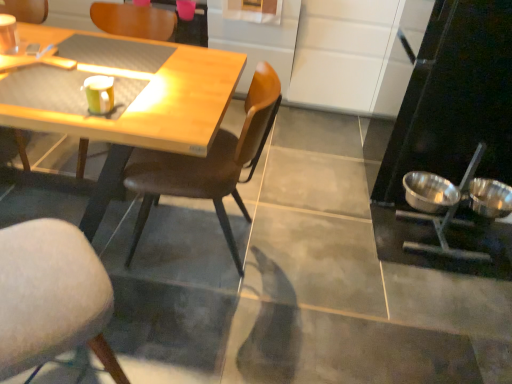
Where is `shiny metallic bowl at right, the second bowl positioned from the left`? shiny metallic bowl at right, the second bowl positioned from the left is located at coordinates (490, 198).

In order to face matte brown chair at left, which is counted as the fourth chair, starting from the right, should I rotate leftwards or rightwards?

To face it directly, rotate left by 30.615 degrees.

Measure the distance between matte brown chair at left, the 1th chair positioned from the left, and camera.

matte brown chair at left, the 1th chair positioned from the left, and camera are 2.25 meters apart from each other.

At what (x,y) coordinates should I click in order to perform the action: click on shiny metallic bowl at right, the 1th bowl viewed from the left. Please return your answer as a coordinate pair (x, y). Looking at the image, I should click on (429, 192).

What is the approximate width of soft gray cushioned chair at lower left, the 2th chair in the right-to-left sequence?

14.13 inches.

I want to click on wooden chair at center, arranged as the 2th chair when viewed from the left, so click(x=134, y=20).

Is soft gray cushioned chair at lower left, the 2th chair in the right-to-left sequence, not inside pink matte coffee cup at upper center, the 2th coffee cup ordered from the bottom?

Absolutely, soft gray cushioned chair at lower left, the 2th chair in the right-to-left sequence, is external to pink matte coffee cup at upper center, the 2th coffee cup ordered from the bottom.

Can you confirm if soft gray cushioned chair at lower left, which is the third chair in left-to-right order, is thinner than pink matte coffee cup at upper center, the 2th coffee cup ordered from the bottom?

In fact, soft gray cushioned chair at lower left, which is the third chair in left-to-right order, might be wider than pink matte coffee cup at upper center, the 2th coffee cup ordered from the bottom.

Is soft gray cushioned chair at lower left, the 2th chair in the right-to-left sequence, with pink matte coffee cup at upper center, the first coffee cup viewed from the back?

No, soft gray cushioned chair at lower left, the 2th chair in the right-to-left sequence, is not touching pink matte coffee cup at upper center, the first coffee cup viewed from the back.

Considering the relative positions of soft gray cushioned chair at lower left, the 2th chair in the right-to-left sequence, and pink matte coffee cup at upper center, acting as the second coffee cup starting from the front, in the image provided, is soft gray cushioned chair at lower left, the 2th chair in the right-to-left sequence, behind pink matte coffee cup at upper center, acting as the second coffee cup starting from the front,?

No, soft gray cushioned chair at lower left, the 2th chair in the right-to-left sequence, is closer to the viewer.

Considering the relative sizes of soft gray cushioned chair at lower left, which is the third chair in left-to-right order, and shiny metallic bowl at right, the second bowl positioned from the left, in the image provided, is soft gray cushioned chair at lower left, which is the third chair in left-to-right order, smaller than shiny metallic bowl at right, the second bowl positioned from the left,?

Incorrect, soft gray cushioned chair at lower left, which is the third chair in left-to-right order, is not smaller in size than shiny metallic bowl at right, the second bowl positioned from the left.

Based on the photo, is soft gray cushioned chair at lower left, the 2th chair in the right-to-left sequence, situated inside shiny metallic bowl at right, the second bowl positioned from the left, or outside?

soft gray cushioned chair at lower left, the 2th chair in the right-to-left sequence, cannot be found inside shiny metallic bowl at right, the second bowl positioned from the left.

Is the depth of soft gray cushioned chair at lower left, the 2th chair in the right-to-left sequence, greater than that of shiny metallic bowl at right, the second bowl positioned from the left?

No, it is in front of shiny metallic bowl at right, the second bowl positioned from the left.

Based on the photo, considering the relative positions of soft gray cushioned chair at lower left, the 2th chair in the right-to-left sequence, and shiny metallic bowl at right, which is counted as the 1th bowl, starting from the right, in the image provided, is soft gray cushioned chair at lower left, the 2th chair in the right-to-left sequence, to the left of shiny metallic bowl at right, which is counted as the 1th bowl, starting from the right, from the viewer's perspective?

Correct, you'll find soft gray cushioned chair at lower left, the 2th chair in the right-to-left sequence, to the left of shiny metallic bowl at right, which is counted as the 1th bowl, starting from the right.

From the image's perspective, is pink matte coffee cup at upper center, arranged as the first coffee cup when viewed from the top, located beneath stainless steel bowls at right?

Incorrect, from the image's perspective, pink matte coffee cup at upper center, arranged as the first coffee cup when viewed from the top, is higher than stainless steel bowls at right.

Between pink matte coffee cup at upper center, the 2th coffee cup ordered from the bottom, and stainless steel bowls at right, which one has larger width?

stainless steel bowls at right.

In terms of height, does pink matte coffee cup at upper center, the first coffee cup viewed from the back, look taller or shorter compared to stainless steel bowls at right?

Considering their sizes, pink matte coffee cup at upper center, the first coffee cup viewed from the back, has less height than stainless steel bowls at right.

Locate an element on the screen. coffee cup lying behind the stainless steel bowls at right is located at coordinates (186, 9).

Is soft gray cushioned chair at lower left, the 2th chair in the right-to-left sequence, taller than stainless steel bowls at right?

No.

Consider the image. Can you confirm if soft gray cushioned chair at lower left, which is the third chair in left-to-right order, is smaller than stainless steel bowls at right?

Yes, soft gray cushioned chair at lower left, which is the third chair in left-to-right order, is smaller than stainless steel bowls at right.

Is the position of soft gray cushioned chair at lower left, the 2th chair in the right-to-left sequence, more distant than that of stainless steel bowls at right?

No, soft gray cushioned chair at lower left, the 2th chair in the right-to-left sequence, is in front of stainless steel bowls at right.

Which chair is the 2nd one when counting from the front of the stainless steel bowls at right? Please provide its 2D coordinates.

[(51, 297)]

Between point (47, 3) and point (454, 190), which one is positioned behind?

Positioned behind is point (47, 3).

In the scene shown: Is matte brown chair at left, the 1th chair positioned from the left, oriented away from shiny metallic bowl at right, the 1th bowl viewed from the left?

No.

Considering the sizes of objects matte brown chair at left, which is counted as the fourth chair, starting from the right, and shiny metallic bowl at right, the 1th bowl viewed from the left, in the image provided, who is taller, matte brown chair at left, which is counted as the fourth chair, starting from the right, or shiny metallic bowl at right, the 1th bowl viewed from the left,?

With more height is matte brown chair at left, which is counted as the fourth chair, starting from the right.

Considering the sizes of objects matte brown chair at left, the 1th chair positioned from the left, and shiny metallic bowl at right, which is the second bowl in right-to-left order, in the image provided, who is smaller, matte brown chair at left, the 1th chair positioned from the left, or shiny metallic bowl at right, which is the second bowl in right-to-left order,?

shiny metallic bowl at right, which is the second bowl in right-to-left order.

From the image's perspective, is shiny metallic bowl at right, which is the second bowl in right-to-left order, positioned above or below matte brown chair at left, the 1th chair positioned from the left?

From the image's perspective, shiny metallic bowl at right, which is the second bowl in right-to-left order, appears below matte brown chair at left, the 1th chair positioned from the left.

Is shiny metallic bowl at right, the 1th bowl viewed from the left, to the right of matte brown chair at left, the 1th chair positioned from the left, from the viewer's perspective?

Indeed, shiny metallic bowl at right, the 1th bowl viewed from the left, is positioned on the right side of matte brown chair at left, the 1th chair positioned from the left.

How much distance is there between shiny metallic bowl at right, the 1th bowl viewed from the left, and matte brown chair at left, the 1th chair positioned from the left?

shiny metallic bowl at right, the 1th bowl viewed from the left, is 2.27 meters from matte brown chair at left, the 1th chair positioned from the left.

Between shiny metallic bowl at right, the 1th bowl viewed from the left, and matte brown chair at left, the 1th chair positioned from the left, which one has larger size?

matte brown chair at left, the 1th chair positioned from the left, is bigger.

Is shiny metallic bowl at right, which is the second bowl in right-to-left order, positioned behind wooden chair at center, arranged as the 2th chair when viewed from the left?

Yes, shiny metallic bowl at right, which is the second bowl in right-to-left order, is further from the camera.

In the scene shown: From a real-world perspective, which is physically below, shiny metallic bowl at right, which is the second bowl in right-to-left order, or wooden chair at center, arranged as the 2th chair when viewed from the left?

shiny metallic bowl at right, which is the second bowl in right-to-left order, from a real-world perspective.

The height and width of the screenshot is (384, 512). I want to click on the 1st bowl below when counting from the wooden chair at center, arranged as the 2th chair when viewed from the left (from the image's perspective), so click(429, 192).

Considering the positions of point (440, 186) and point (144, 14), is point (440, 186) closer or farther from the camera than point (144, 14)?

Point (440, 186).

This screenshot has width=512, height=384. I want to click on coffee cup that is the 2nd object located behind the soft gray cushioned chair at lower left, the 2th chair in the right-to-left sequence, so click(x=186, y=9).

What are the coordinates of `chair that is the 2nd object to the left of the shiny metallic bowl at right, the second bowl positioned from the left, starting at the anchor` in the screenshot? It's located at (51, 297).

From the image, which object appears to be farther from stainless steel bowls at right, wooden chair at center, the 3th chair in the right-to-left sequence, or soft gray cushioned chair at lower left, the 2th chair in the right-to-left sequence?

wooden chair at center, the 3th chair in the right-to-left sequence, is further to stainless steel bowls at right.

When comparing their distances from brown leather chair at center, positioned as the 1th chair in right-to-left order, does shiny metallic bowl at right, which is counted as the 1th bowl, starting from the right, or soft gray cushioned chair at lower left, the 2th chair in the right-to-left sequence, seem further?

shiny metallic bowl at right, which is counted as the 1th bowl, starting from the right, is positioned further to the anchor brown leather chair at center, positioned as the 1th chair in right-to-left order.

From the image, which object appears to be farther from wooden chair at center, the 3th chair in the right-to-left sequence, shiny metallic bowl at right, the 1th bowl viewed from the left, or shiny metallic bowl at right, the second bowl positioned from the left?

The object further to wooden chair at center, the 3th chair in the right-to-left sequence, is shiny metallic bowl at right, the second bowl positioned from the left.

From the image, which object appears to be nearer to brown leather chair at center, positioned as the 1th chair in right-to-left order, soft gray cushioned chair at lower left, the 2th chair in the right-to-left sequence, or matte brown chair at left, which is counted as the fourth chair, starting from the right?

Among the two, soft gray cushioned chair at lower left, the 2th chair in the right-to-left sequence, is located nearer to brown leather chair at center, positioned as the 1th chair in right-to-left order.

When comparing their distances from pink matte coffee cup at upper center, acting as the second coffee cup starting from the front, does matte brown chair at left, which is counted as the fourth chair, starting from the right, or brown leather chair at center, positioned as the 1th chair in right-to-left order, seem closer?

matte brown chair at left, which is counted as the fourth chair, starting from the right.

Consider the image. Estimate the real-world distances between objects in this image. Which object is closer to shiny metallic bowl at right, which is the second bowl in right-to-left order, soft gray cushioned chair at lower left, the 2th chair in the right-to-left sequence, or shiny metallic bowl at right, which is counted as the 1th bowl, starting from the right?

shiny metallic bowl at right, which is counted as the 1th bowl, starting from the right, is positioned closer to the anchor shiny metallic bowl at right, which is the second bowl in right-to-left order.

Considering their positions, is shiny metallic bowl at right, which is counted as the 1th bowl, starting from the right, positioned further to shiny metallic bowl at right, which is the second bowl in right-to-left order, than wooden chair at center, the 3th chair in the right-to-left sequence?

wooden chair at center, the 3th chair in the right-to-left sequence.

Considering their positions, is stainless steel bowls at right positioned closer to soft gray cushioned chair at lower left, the 2th chair in the right-to-left sequence, than shiny metallic bowl at right, which is the second bowl in right-to-left order?

shiny metallic bowl at right, which is the second bowl in right-to-left order, is positioned closer to the anchor soft gray cushioned chair at lower left, the 2th chair in the right-to-left sequence.

You are a GUI agent. You are given a task and a screenshot of the screen. Output one action in this format:
    pyautogui.click(x=<x>, y=<y>)
    Task: Click on the chair between matte yellow cup at upper left, arranged as the first coffee cup when ordered from the bottom, and wooden chair at center, the 3th chair in the right-to-left sequence, from front to back
    This screenshot has width=512, height=384.
    Given the screenshot: What is the action you would take?
    pyautogui.click(x=209, y=163)

I want to click on chair between soft gray cushioned chair at lower left, the 2th chair in the right-to-left sequence, and wooden chair at center, arranged as the 2th chair when viewed from the left, along the z-axis, so click(x=209, y=163).

At what (x,y) coordinates should I click in order to perform the action: click on bowl between pink matte coffee cup at upper center, the first coffee cup viewed from the back, and stainless steel bowls at right. Please return your answer as a coordinate pair (x, y). This screenshot has height=384, width=512. Looking at the image, I should click on (429, 192).

You are a GUI agent. You are given a task and a screenshot of the screen. Output one action in this format:
    pyautogui.click(x=<x>, y=<y>)
    Task: Click on the appliance between soft gray cushioned chair at lower left, which is the third chair in left-to-right order, and pink matte coffee cup at upper center, the first coffee cup viewed from the back, in the front-back direction
    This screenshot has height=384, width=512.
    Given the screenshot: What is the action you would take?
    [451, 143]